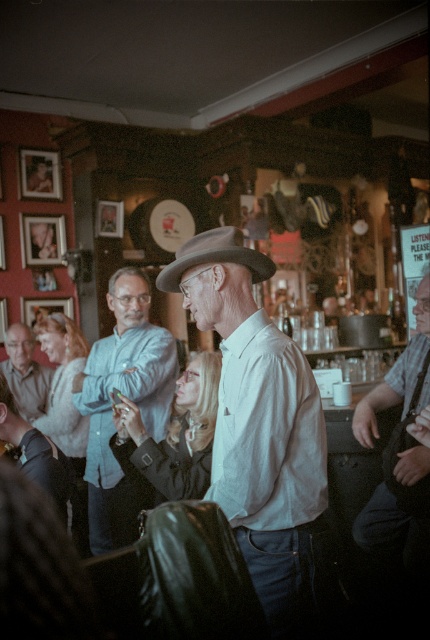
Does light blue shirt at center appear under gray felt fedora at center?

Indeed, light blue shirt at center is positioned under gray felt fedora at center.

Is light blue shirt at center in front of gray felt fedora at center?

No, light blue shirt at center is further to the viewer.

Does point (88, 438) come in front of point (252, 256)?

That is False.

Image resolution: width=430 pixels, height=640 pixels. I want to click on light blue shirt at center, so click(129, 397).

Between light blue shirt at center and matte gray shirt at lower left, which one has less height?

With less height is matte gray shirt at lower left.

Is light blue shirt at center positioned before matte gray shirt at lower left?

Yes, light blue shirt at center is closer to the viewer.

You are a GUI agent. You are given a task and a screenshot of the screen. Output one action in this format:
    pyautogui.click(x=<x>, y=<y>)
    Task: Click on the light blue shirt at center
    The image size is (430, 640).
    Given the screenshot: What is the action you would take?
    click(129, 397)

Where is `light blue shirt at center`? The height and width of the screenshot is (640, 430). light blue shirt at center is located at coordinates (129, 397).

Does gray felt fedora at center appear on the left side of matte gray shirt at lower left?

Incorrect, gray felt fedora at center is not on the left side of matte gray shirt at lower left.

The image size is (430, 640). What do you see at coordinates (215, 257) in the screenshot?
I see `gray felt fedora at center` at bounding box center [215, 257].

Where is `gray felt fedora at center`? The width and height of the screenshot is (430, 640). gray felt fedora at center is located at coordinates (215, 257).